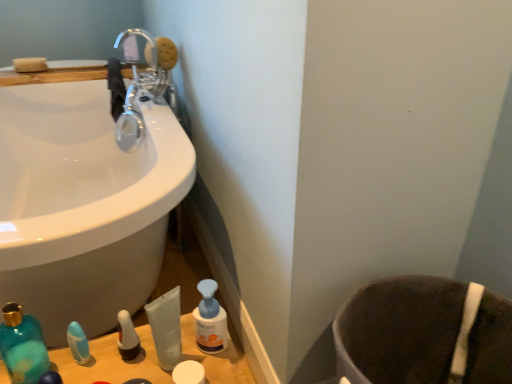
Locate an element on the screen. The height and width of the screenshot is (384, 512). vacant area that lies to the right of blue glossy tube at lower left, positioned as the 1th toiletry in left-to-right order is located at coordinates (144, 357).